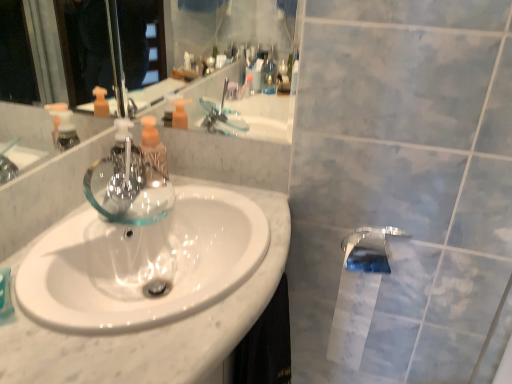
Question: From a real-world perspective, is transparent glass tap at center, acting as the 2th tap starting from the right, positioned above or below white paper at lower right?

Choices:
 (A) below
 (B) above

Answer: (B)

Question: Looking at the image, does transparent glass tap at center, the first tap from the top, seem bigger or smaller compared to white paper at lower right?

Choices:
 (A) big
 (B) small

Answer: (A)

Question: Which object is positioned farthest from the white glossy sink at center?

Choices:
 (A) translucent plastic soap dispenser at center
 (B) polished chrome tap at lower right, the first tap when ordered from bottom to top
 (C) white paper at lower right
 (D) transparent glass tap at center, acting as the 2th tap starting from the right

Answer: (B)

Question: Considering the real-world distances, which object is closest to the translucent plastic soap dispenser at center?

Choices:
 (A) transparent glass tap at center, acting as the 2th tap starting from the right
 (B) white glossy sink at center
 (C) polished chrome tap at lower right, acting as the second tap starting from the left
 (D) white paper at lower right

Answer: (A)